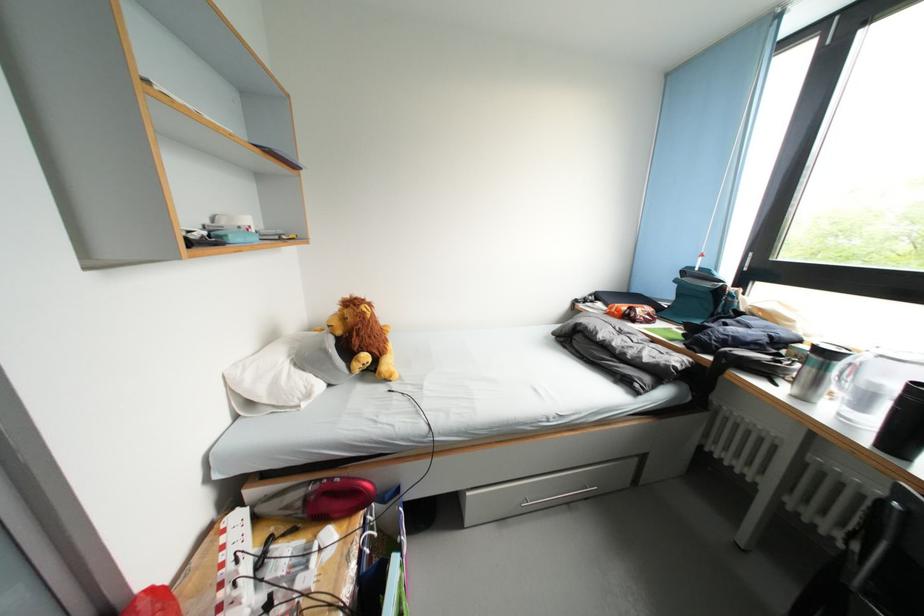
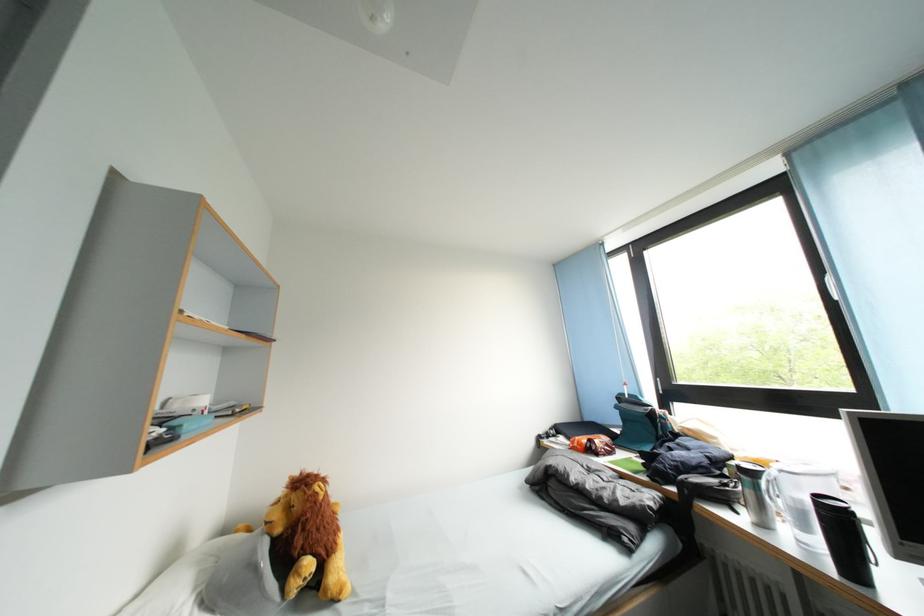
In the second image, find the point that corresponds to pixel 710 260 in the first image.

(634, 389)